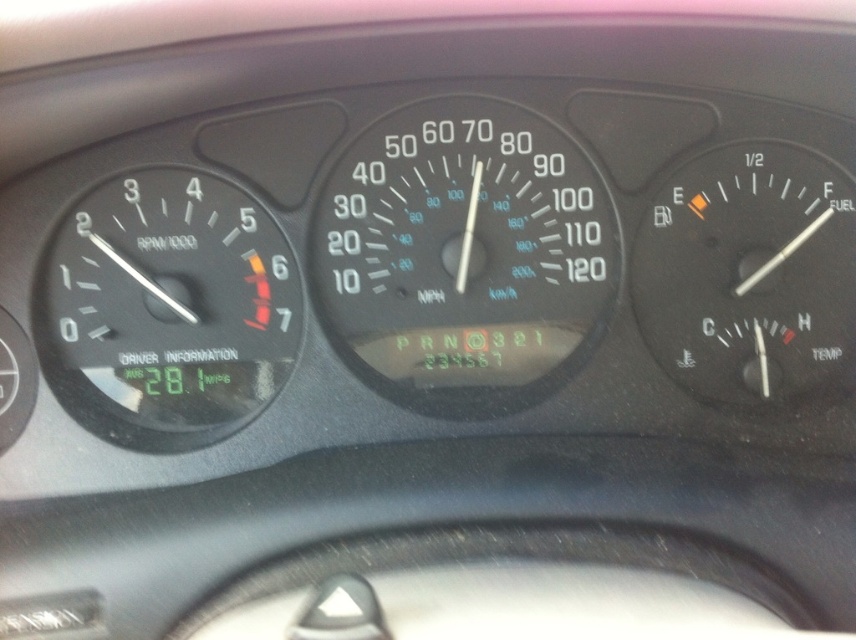
Question: Which is nearer to the white plastic speedometer at center?

Choices:
 (A) transparent plastic fuel gauge at right
 (B) black plastic speedometer at left

Answer: (A)

Question: Is black plastic speedometer at left smaller than transparent plastic fuel gauge at right?

Choices:
 (A) no
 (B) yes

Answer: (A)

Question: Is white plastic speedometer at center above black plastic speedometer at left?

Choices:
 (A) yes
 (B) no

Answer: (A)

Question: Observing the image, what is the correct spatial positioning of white plastic speedometer at center in reference to black plastic speedometer at left?

Choices:
 (A) below
 (B) above

Answer: (B)

Question: Which is nearer to the transparent plastic fuel gauge at right?

Choices:
 (A) black plastic speedometer at left
 (B) white plastic speedometer at center

Answer: (B)

Question: Which object is farther from the camera taking this photo?

Choices:
 (A) transparent plastic fuel gauge at right
 (B) white plastic speedometer at center
 (C) black plastic speedometer at left

Answer: (B)